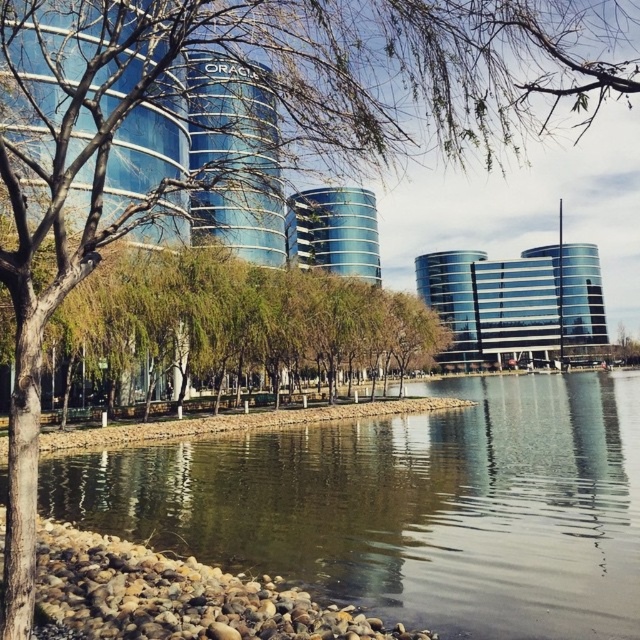
You are standing at the shoreline looking towards the buildings. There are two points marked on the image, one at coordinates point [404,564] and another at point [464,404]. Which point is closer to you?

Point [404,564] is in front of point [464,404], so it is closer to you.

You are standing at the shoreline looking towards the modern architectural complex. According to the image, where is the green reflective water located relative to the point marked at coordinates [408,506]?

The point marked at coordinates [408,506] is exactly where the green reflective water at center is located.

You are standing at the edge of the scene and want to reach the green reflective water at center. Which direction should you move relative to the smooth stone water at lower center?

You should move to the right of the smooth stone water at lower center to reach the green reflective water at center.